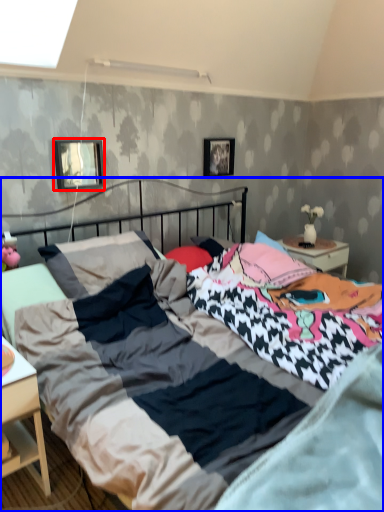
Question: Which object appears closest to the camera in this image, picture frame (highlighted by a red box) or bed (highlighted by a blue box)?

Choices:
 (A) picture frame
 (B) bed

Answer: (B)